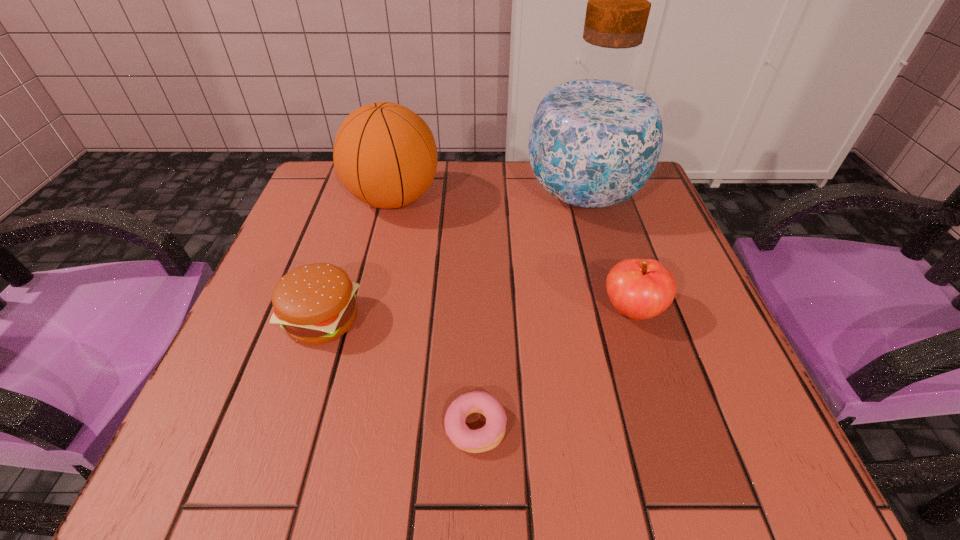
Locate an element on the screen. The height and width of the screenshot is (540, 960). free spot located 0.240m on the back of the nearest object is located at coordinates (477, 284).

This screenshot has height=540, width=960. I want to click on water jug present at the far edge, so click(596, 136).

I want to click on basketball that is at the far edge, so click(x=385, y=155).

I want to click on object that is positioned at the near edge, so 486,438.

Locate an element on the screen. The width and height of the screenshot is (960, 540). basketball at the left edge is located at coordinates (385, 155).

Find the location of a particular element. Image resolution: width=960 pixels, height=540 pixels. hamburger at the left edge is located at coordinates (315, 303).

The height and width of the screenshot is (540, 960). What are the coordinates of `water jug located at the right edge` in the screenshot? It's located at (596, 136).

Image resolution: width=960 pixels, height=540 pixels. Find the location of `apple that is positioned at the right edge`. apple that is positioned at the right edge is located at coordinates (638, 288).

Find the location of `object that is at the far left corner`. object that is at the far left corner is located at coordinates (385, 155).

Locate an element on the screen. object that is at the far right corner is located at coordinates (596, 136).